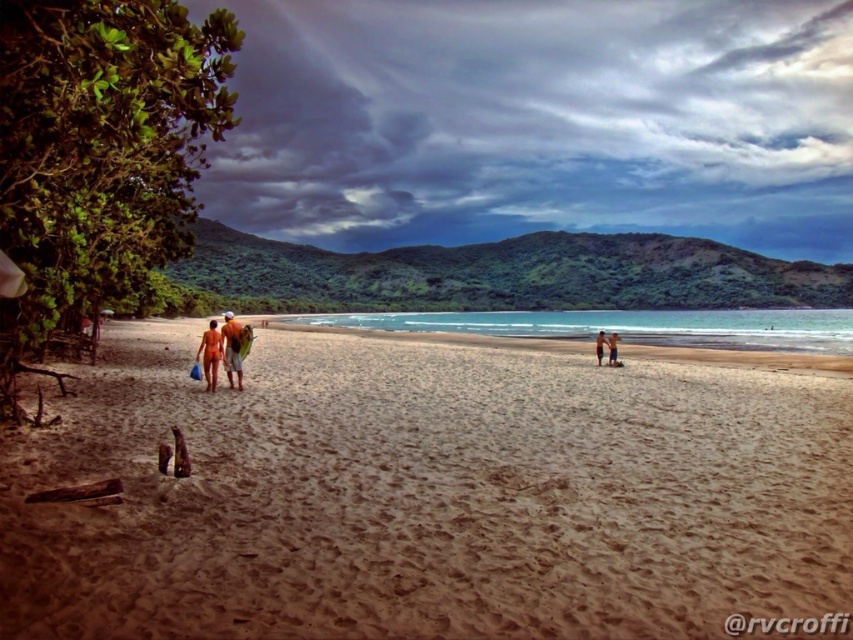
Question: Can you confirm if brown sandy beach at center is positioned to the right of tan skin human at center?

Choices:
 (A) yes
 (B) no

Answer: (B)

Question: Which point is farther from the camera taking this photo?

Choices:
 (A) (73, 636)
 (B) (610, 339)
 (C) (239, 378)
 (D) (206, 358)

Answer: (B)

Question: Is brown sandy beach at center closer to the viewer compared to smooth tan skin at center?

Choices:
 (A) yes
 (B) no

Answer: (A)

Question: Among these objects, which one is nearest to the camera?

Choices:
 (A) tan skin human at center
 (B) tan skin couple at center
 (C) smooth tan skin at center
 (D) orange matte surfboard at center

Answer: (D)

Question: Is orange fabric shorts at center thinner than matte skin human at center-left?

Choices:
 (A) no
 (B) yes

Answer: (A)

Question: Which of the following is the closest to the observer?

Choices:
 (A) orange matte surfboard at center
 (B) tan skin couple at center
 (C) orange fabric shorts at center

Answer: (A)